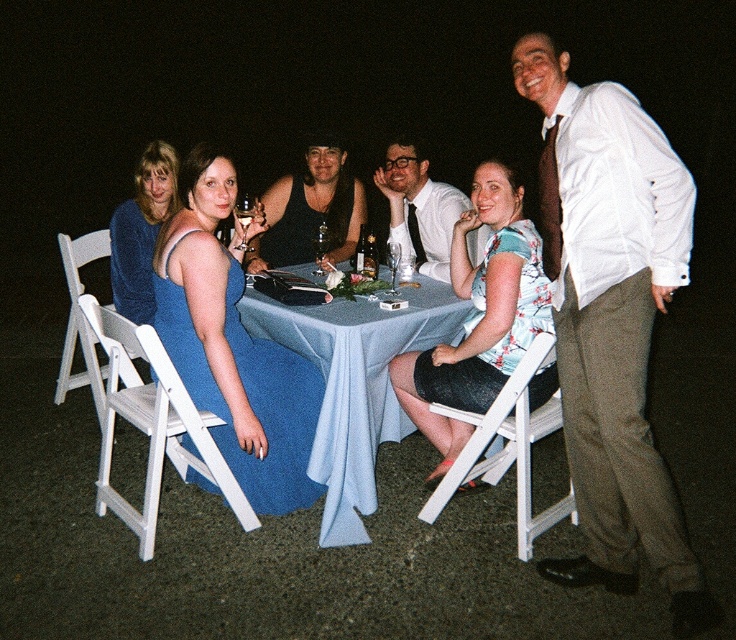
Is floral fabric dress at center bigger than velvet blue dress at left?

Yes.

Identify the location of floral fabric dress at center. This screenshot has width=736, height=640. (478, 316).

Is point (531, 252) behind point (144, 209)?

No, it is not.

I want to click on floral fabric dress at center, so click(x=478, y=316).

Is white textured shirt at center to the left of velvet blue dress at left from the viewer's perspective?

Incorrect, white textured shirt at center is not on the left side of velvet blue dress at left.

Describe the element at coordinates (612, 321) in the screenshot. I see `white textured shirt at center` at that location.

Where is `white textured shirt at center`? This screenshot has height=640, width=736. white textured shirt at center is located at coordinates (612, 321).

Is matte black glasses at center to the right of velvet blue dress at left from the viewer's perspective?

Yes, matte black glasses at center is to the right of velvet blue dress at left.

Who is taller, matte black glasses at center or velvet blue dress at left?

velvet blue dress at left is taller.

Between point (420, 252) and point (176, 200), which one is positioned behind?

The point (420, 252) is behind.

I want to click on matte black glasses at center, so click(x=420, y=205).